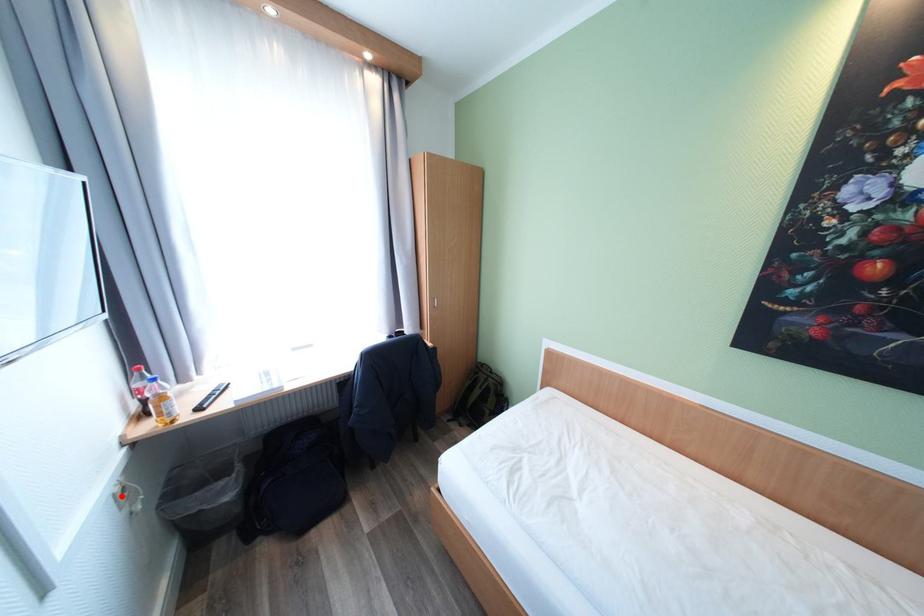
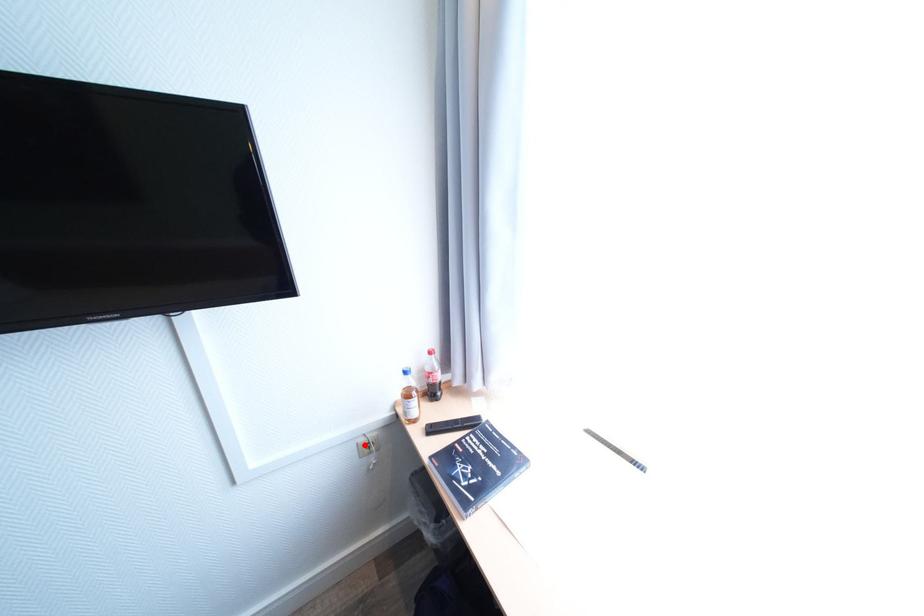
I am providing you with two images of the same scene from different viewpoints. A red point is marked on the first image and another point is marked on the second image. Is the red point in image1 aligned with the point shown in image2?

Yes